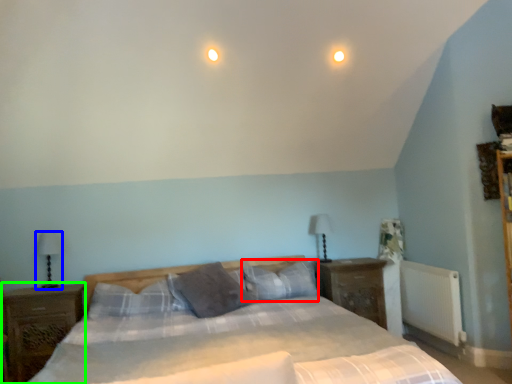
Question: Estimate the real-world distances between objects in this image. Which object is farther from pillow (highlighted by a red box), table lamp (highlighted by a blue box) or nightstand (highlighted by a green box)?

Choices:
 (A) table lamp
 (B) nightstand

Answer: (A)